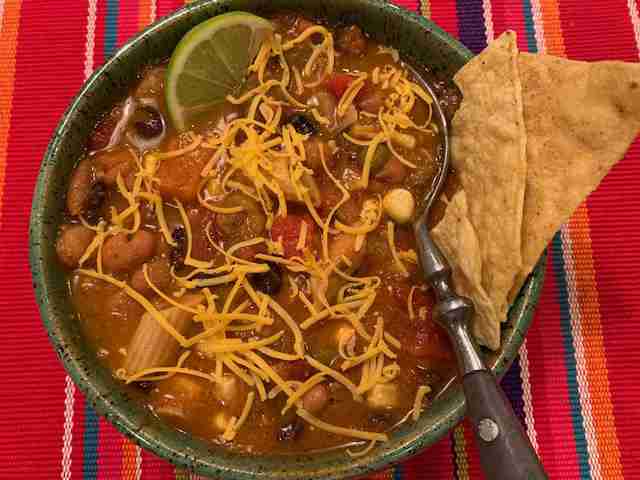
This screenshot has width=640, height=480. In order to click on green bowl in this screenshot , I will do `click(48, 206)`.